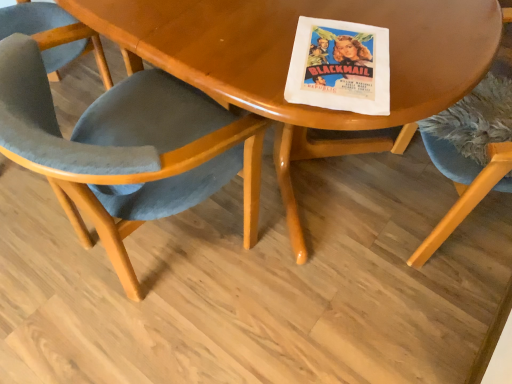
This screenshot has width=512, height=384. Identify the location of free space above velvet blue chair at center, acting as the 2th chair starting from the right (from a real-world perspective). (156, 43).